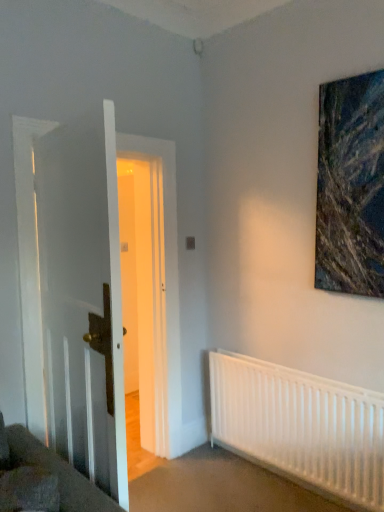
Question: Does white matte radiator at lower right have a lesser height compared to white wooden door at left?

Choices:
 (A) no
 (B) yes

Answer: (B)

Question: Does white matte radiator at lower right have a greater width compared to white wooden door at left?

Choices:
 (A) no
 (B) yes

Answer: (A)

Question: From a real-world perspective, is white matte radiator at lower right on top of white wooden door at left?

Choices:
 (A) no
 (B) yes

Answer: (A)

Question: Considering the relative positions of white matte radiator at lower right and white wooden door at left in the image provided, is white matte radiator at lower right in front of white wooden door at left?

Choices:
 (A) yes
 (B) no

Answer: (B)

Question: Considering the relative sizes of white matte radiator at lower right and white wooden door at left in the image provided, is white matte radiator at lower right taller than white wooden door at left?

Choices:
 (A) yes
 (B) no

Answer: (B)

Question: Does white matte radiator at lower right appear on the left side of white wooden door at left?

Choices:
 (A) no
 (B) yes

Answer: (A)

Question: From the image's perspective, is white wooden door at left under textured canvas painting at upper right?

Choices:
 (A) yes
 (B) no

Answer: (A)

Question: From a real-world perspective, is white wooden door at left physically below textured canvas painting at upper right?

Choices:
 (A) yes
 (B) no

Answer: (A)

Question: Is white wooden door at left taller than textured canvas painting at upper right?

Choices:
 (A) no
 (B) yes

Answer: (B)

Question: Is white wooden door at left shorter than textured canvas painting at upper right?

Choices:
 (A) yes
 (B) no

Answer: (B)

Question: From a real-world perspective, is white wooden door at left physically above textured canvas painting at upper right?

Choices:
 (A) yes
 (B) no

Answer: (B)

Question: Is white wooden door at left thinner than textured canvas painting at upper right?

Choices:
 (A) no
 (B) yes

Answer: (A)

Question: Is textured canvas painting at upper right oriented towards white matte radiator at lower right?

Choices:
 (A) no
 (B) yes

Answer: (A)